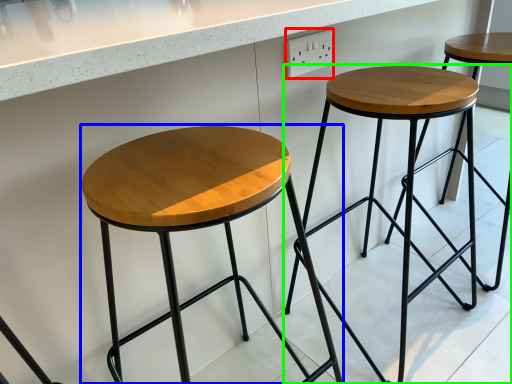
Question: Which object is positioned closest to electric outlet (highlighted by a red box)? Select from stool (highlighted by a blue box) and stool (highlighted by a green box).

Choices:
 (A) stool
 (B) stool

Answer: (B)